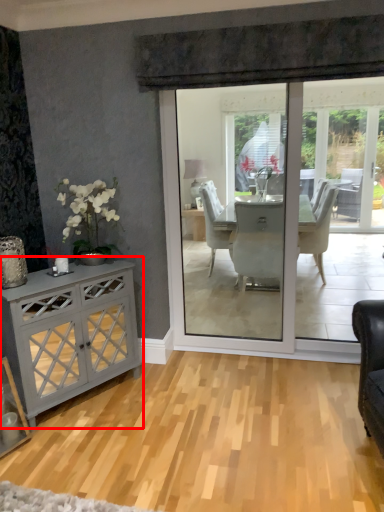
Question: In this image, where is cabinetry (annotated by the red box) located relative to plain?

Choices:
 (A) left
 (B) right

Answer: (A)